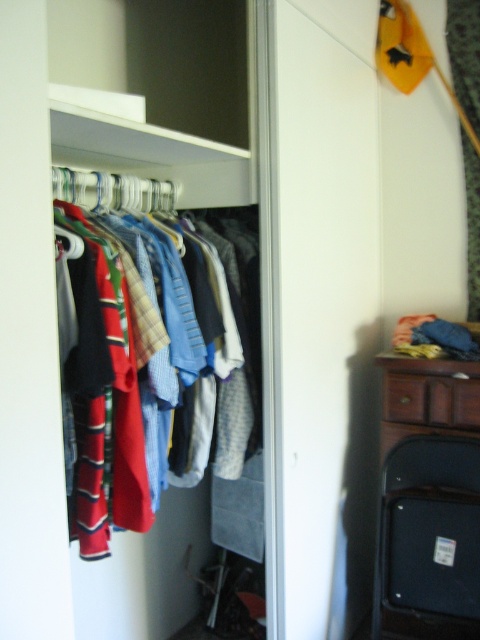
Can you confirm if black hard suitcase at lower right is bigger than metallic silver hanger at center?

Yes, black hard suitcase at lower right is bigger than metallic silver hanger at center.

This screenshot has width=480, height=640. What are the coordinates of `black hard suitcase at lower right` in the screenshot? It's located at (429, 540).

At what (x,y) coordinates should I click in order to perform the action: click on black hard suitcase at lower right. Please return your answer as a coordinate pair (x, y). The image size is (480, 640). Looking at the image, I should click on (429, 540).

Between brown wood drawer at right and metallic silver hanger at center, which one is positioned higher?

metallic silver hanger at center is higher up.

Does brown wood drawer at right have a lesser height compared to metallic silver hanger at center?

Incorrect, brown wood drawer at right's height does not fall short of metallic silver hanger at center's.

Who is more forward, (x=429, y=387) or (x=84, y=189)?

Point (x=84, y=189)

The height and width of the screenshot is (640, 480). Find the location of `brown wood drawer at right`. brown wood drawer at right is located at coordinates (432, 400).

Is multicolored fabric shirts at center taller than white fabric curtain at upper right?

No.

Describe the element at coordinates (187, 317) in the screenshot. I see `multicolored fabric shirts at center` at that location.

This screenshot has width=480, height=640. What are the coordinates of `multicolored fabric shirts at center` in the screenshot? It's located at (187, 317).